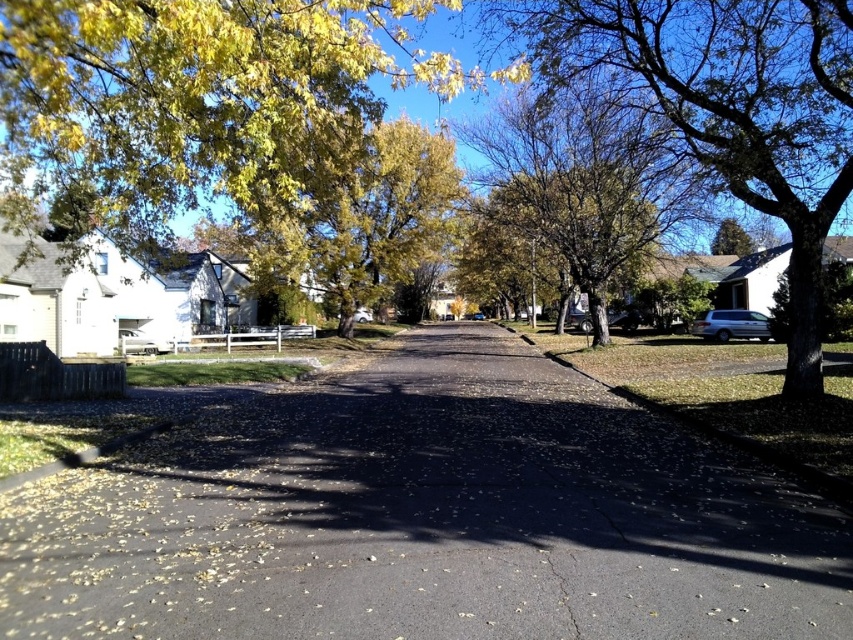
Who is lower down, asphalt at center or green leafy tree at right?

Positioned lower is asphalt at center.

Which is in front, point (384, 442) or point (715, 104)?

Positioned in front is point (384, 442).

Identify the location of asphalt at center. This screenshot has width=853, height=640. (427, 518).